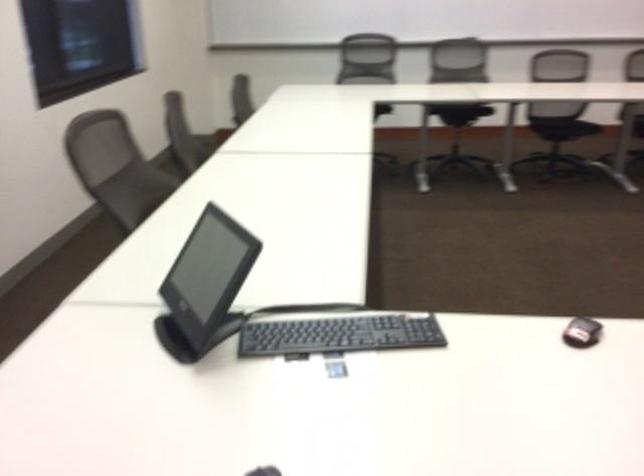
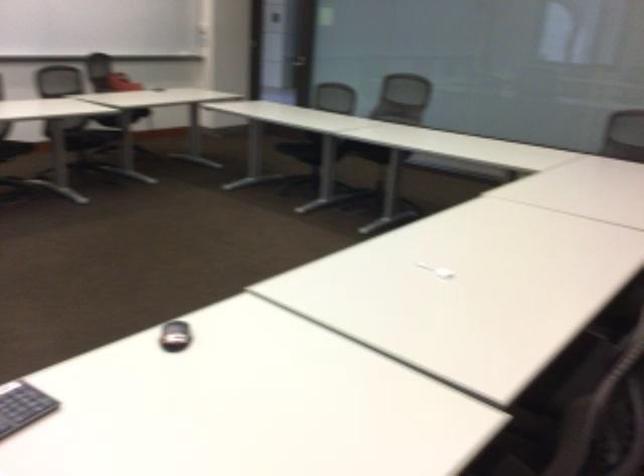
Question: Which direction would the cameraman need to move to produce the second image? Reply with the corresponding letter.

Choices:
 (A) Left
 (B) Right
 (C) Forward
 (D) Backward

Answer: (D)